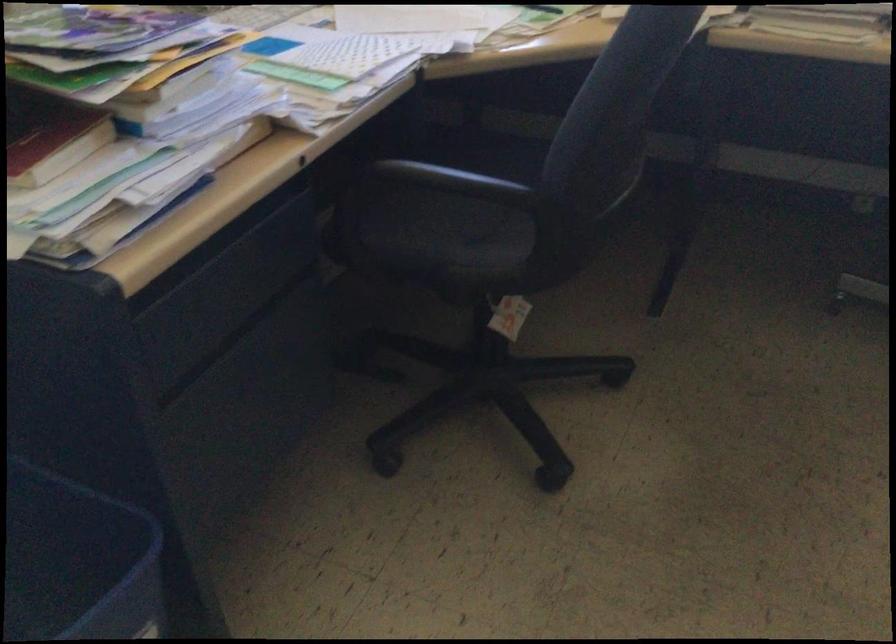
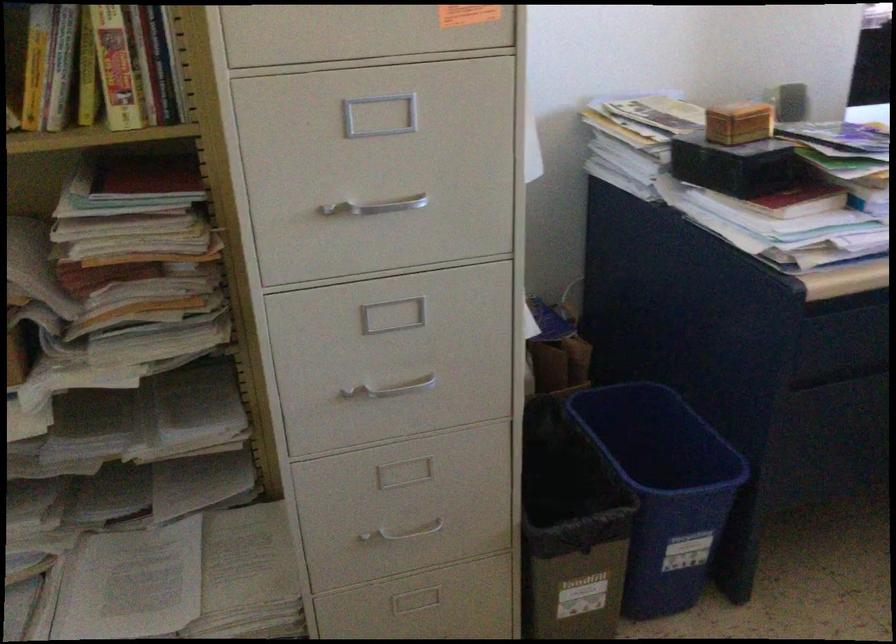
Question: The images are taken continuously from a first-person perspective. In which direction is your viewpoint rotating?

Choices:
 (A) Left
 (B) Right
 (C) Up
 (D) Down

Answer: (A)